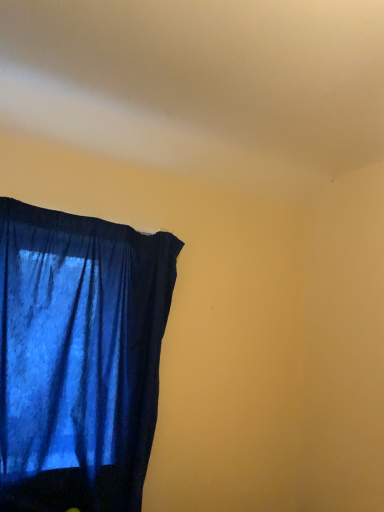
Locate an element on the screen. The width and height of the screenshot is (384, 512). satin blue curtain at left is located at coordinates (79, 358).

What do you see at coordinates (79, 358) in the screenshot? This screenshot has height=512, width=384. I see `satin blue curtain at left` at bounding box center [79, 358].

You are a GUI agent. You are given a task and a screenshot of the screen. Output one action in this format:
    pyautogui.click(x=<x>, y=<y>)
    Task: Click on the satin blue curtain at left
    This screenshot has height=512, width=384.
    Given the screenshot: What is the action you would take?
    pyautogui.click(x=79, y=358)